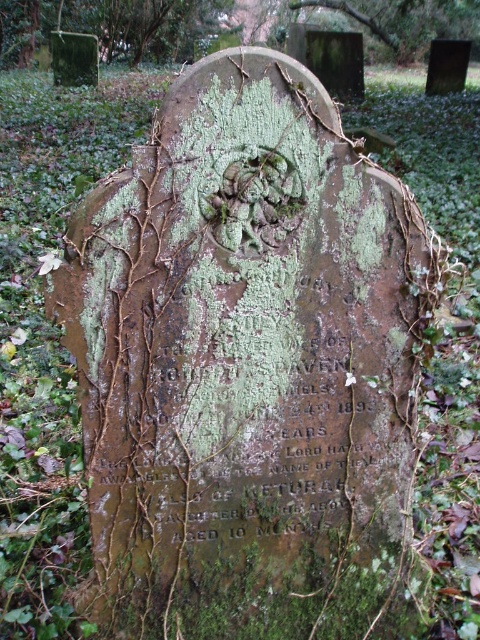
Which of these two, green mossy tree at upper center or green mossy gravestone at upper center, stands shorter?

With less height is green mossy gravestone at upper center.

Which is behind, point (50, 20) or point (408, 54)?

Point (408, 54)

What do you see at coordinates (108, 26) in the screenshot? I see `green mossy tree at upper center` at bounding box center [108, 26].

Where is `green mossy tree at upper center`? green mossy tree at upper center is located at coordinates (108, 26).